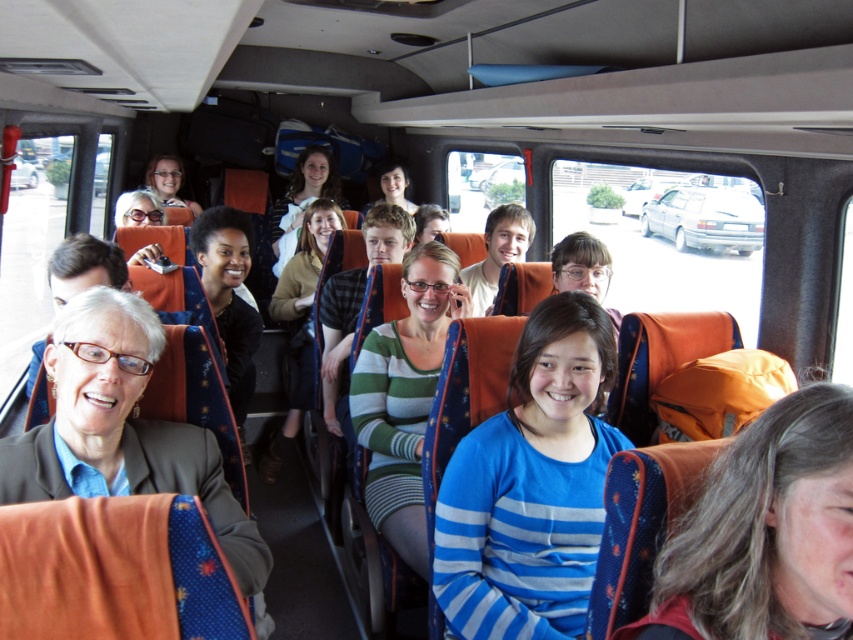
Is blue striped shirt at center to the right of matte green sweater at center from the viewer's perspective?

Yes, blue striped shirt at center is to the right of matte green sweater at center.

Measure the distance from blue striped shirt at center to matte green sweater at center.

blue striped shirt at center is 4.74 meters away from matte green sweater at center.

Locate an element on the screen. This screenshot has height=640, width=853. blue striped shirt at center is located at coordinates (531, 484).

Is point (830, 513) farther from camera compared to point (514, 236)?

No, (830, 513) is in front of (514, 236).

Can you confirm if gray hair at right is positioned above light brown hair at center?

Incorrect, gray hair at right is not positioned above light brown hair at center.

Where is `gray hair at right`? The height and width of the screenshot is (640, 853). gray hair at right is located at coordinates (764, 532).

Describe the element at coordinates (404, 396) in the screenshot. This screenshot has width=853, height=640. I see `green and white striped sweater at center` at that location.

Does point (428, 356) come in front of point (178, 168)?

Yes, it is.

I want to click on green and white striped sweater at center, so click(x=404, y=396).